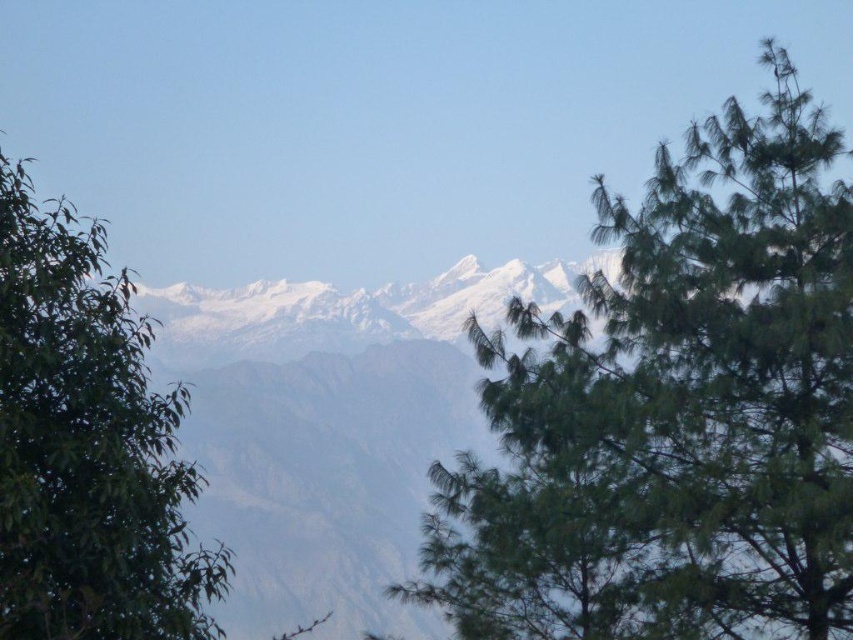
Does green needle-like tree at center have a greater width compared to green leafy tree at left?

Incorrect, green needle-like tree at center's width does not surpass green leafy tree at left's.

Can you confirm if green needle-like tree at center is shorter than green leafy tree at left?

In fact, green needle-like tree at center may be taller than green leafy tree at left.

Is point (583, 586) less distant than point (7, 579)?

No, (583, 586) is behind (7, 579).

This screenshot has width=853, height=640. I want to click on green needle-like tree at center, so click(x=675, y=413).